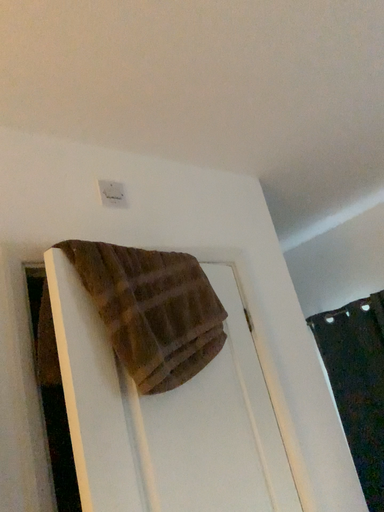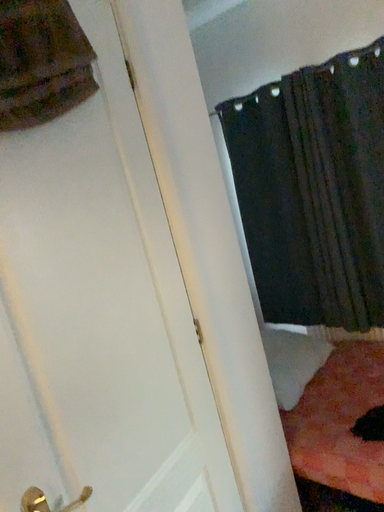
Question: Which way did the camera rotate in the video?

Choices:
 (A) rotated upward
 (B) rotated downward

Answer: (B)